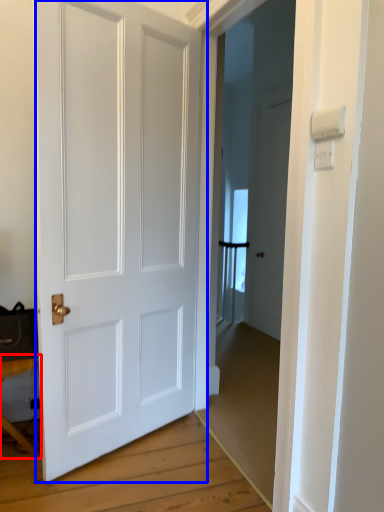
Question: Which point is further to the camera, table (highlighted by a red box) or door (highlighted by a blue box)?

Choices:
 (A) table
 (B) door

Answer: (A)